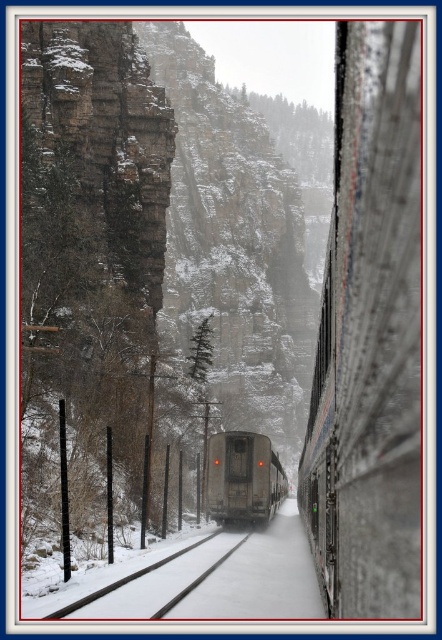
You are standing on the train track in the snowy valley and see two points marked on the ground, point 1 at coordinates point (221, 442) and point 2 at point (198, 540). Which point is closer to you?

Point (221, 442) is closer to you because it is further to the viewer than point (198, 540).

You are a passenger on a train traveling through a narrow valley surrounded by snow. You look out the window and see the gray metallic train at center. Based on its position, can you estimate how far the train is from the nearest cliff on either side?

The gray metallic train at center is positioned at coordinates point (243, 477). However, without specific spatial measurements between the train and the cliffs, it is impossible to determine the exact distance from the nearest cliff.